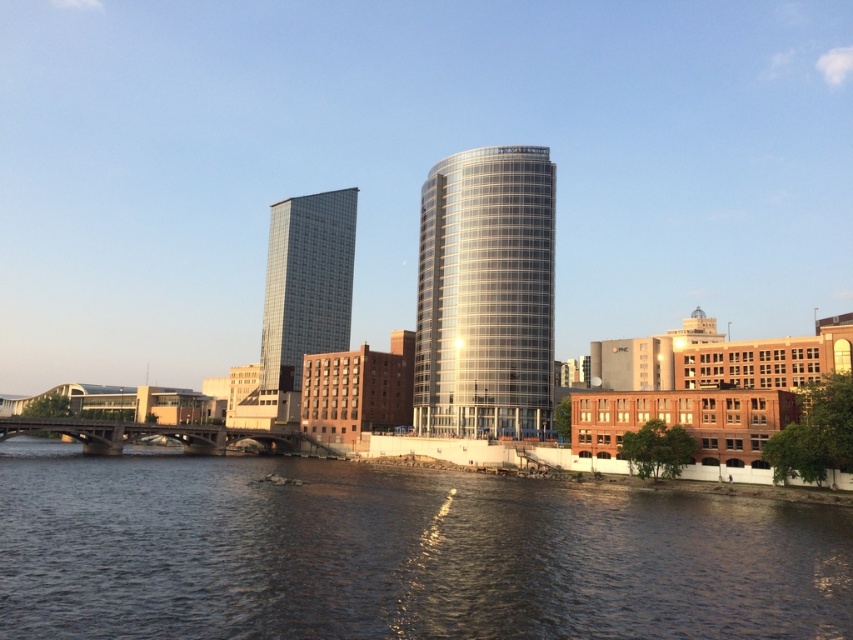
You are a photographer standing on the bridge and want to capture both the dark blue water at center and the glassy reflective skyscraper at center in a single shot. Based on their positions, which one should you adjust your camera to focus on first to ensure both are in frame?

Since the dark blue water at center is to the right of the glassy reflective skyscraper at center, you should first focus on the glassy reflective skyscraper at center to ensure both it and the water to its right are within the frame.

You are standing on the bridge and want to take a photo of the dark blue water at center and the shiny glass tower at center. Which object will appear larger in your camera view?

The dark blue water at center will appear larger in the camera view because it is closer to the viewer than the shiny glass tower at center.